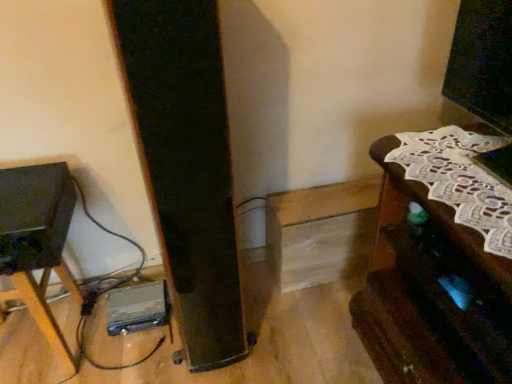
Question: Which is correct: metallic silver tripod at lower left, the 1th furniture positioned from the left, is inside matte black speaker at left, or outside of it?

Choices:
 (A) outside
 (B) inside

Answer: (A)

Question: From a real-world perspective, is metallic silver tripod at lower left, the 1th furniture positioned from the left, physically located above or below matte black speaker at left?

Choices:
 (A) above
 (B) below

Answer: (B)

Question: Which of these objects is positioned closest to the brown wooden table at right, which is the second furniture from left to right?

Choices:
 (A) matte black speaker at left
 (B) metallic silver tripod at lower left, the 2th furniture viewed from the right

Answer: (A)

Question: Which is farther from the brown wooden table at right, which is the second furniture from left to right?

Choices:
 (A) matte black speaker at left
 (B) metallic silver tripod at lower left, the 1th furniture positioned from the left

Answer: (B)